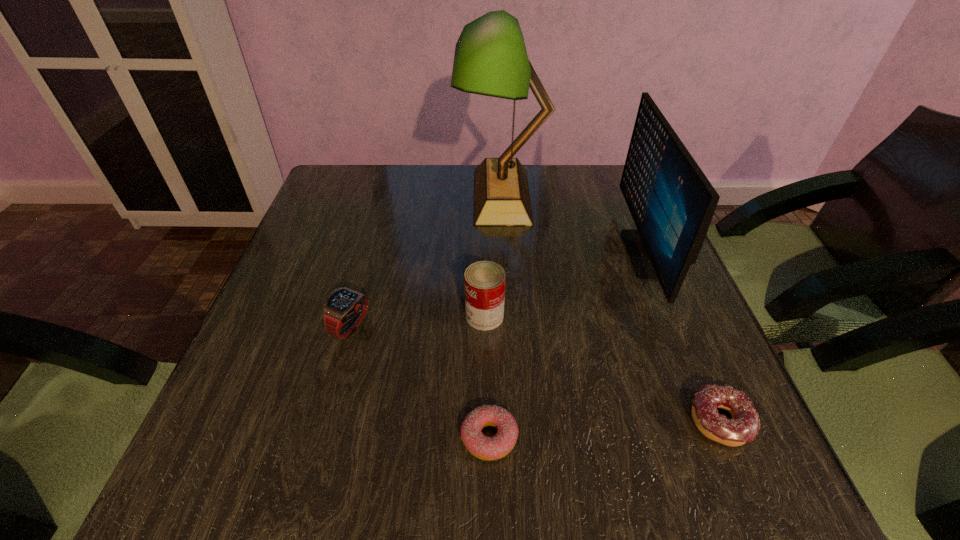
The height and width of the screenshot is (540, 960). Identify the location of free space at the left edge of the desktop. (351, 271).

In the image, there is a desktop. Find the location of `free space at the right edge`. free space at the right edge is located at coordinates (619, 239).

The height and width of the screenshot is (540, 960). In the image, there is a desktop. Identify the location of vacant space at the near left corner. (227, 449).

In the image, there is a desktop. Where is `free space at the far right corner`? The height and width of the screenshot is (540, 960). free space at the far right corner is located at coordinates 622,209.

I want to click on empty space between the left doughnut and the fourth shortest object, so click(x=487, y=376).

This screenshot has height=540, width=960. In order to click on free space between the tallest object and the computer monitor in this screenshot , I will do `click(574, 225)`.

In order to click on vacant area that lies between the right doughnut and the tallest object in this screenshot , I will do (612, 308).

What are the coordinates of `vacant space that's between the table lamp and the computer monitor` in the screenshot? It's located at (574, 225).

Image resolution: width=960 pixels, height=540 pixels. I want to click on free space between the left doughnut and the can, so click(487, 376).

Where is `vacant area between the can and the second tallest object`? The image size is (960, 540). vacant area between the can and the second tallest object is located at coordinates (565, 285).